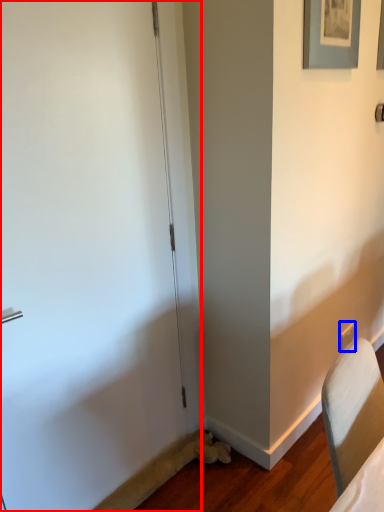
Question: Which of the following is the farthest to the observer, door (highlighted by a red box) or electric outlet (highlighted by a blue box)?

Choices:
 (A) door
 (B) electric outlet

Answer: (B)